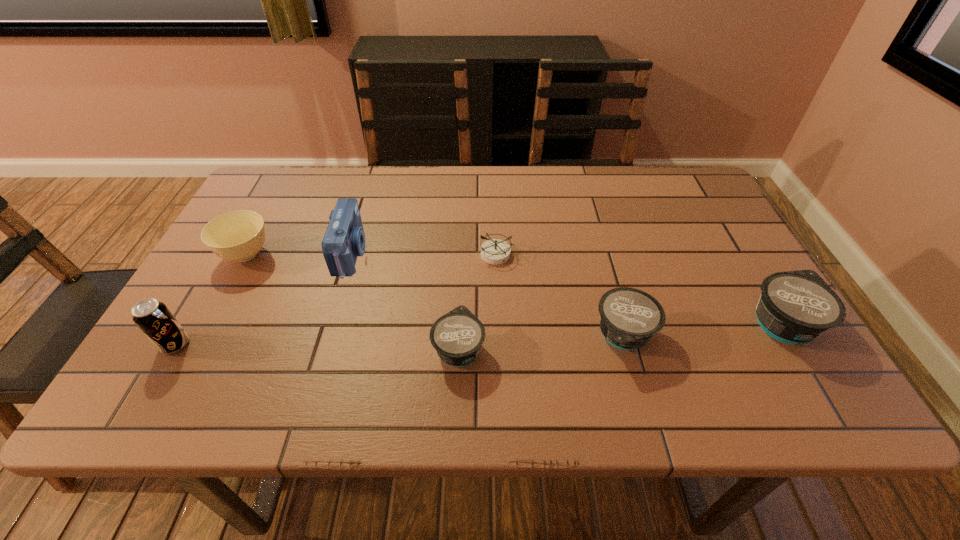
Where is `the leftmost yogurt`? The height and width of the screenshot is (540, 960). the leftmost yogurt is located at coordinates (457, 336).

I want to click on the second yogurt from right to left, so click(629, 317).

This screenshot has width=960, height=540. Find the location of `the third shortest object`. the third shortest object is located at coordinates [x=629, y=317].

Where is `the rightmost object`? Image resolution: width=960 pixels, height=540 pixels. the rightmost object is located at coordinates (794, 307).

This screenshot has width=960, height=540. Find the location of `sugar bowl`. sugar bowl is located at coordinates (239, 235).

The width and height of the screenshot is (960, 540). Identify the location of the third object from left to right. (344, 240).

At what (x,y) coordinates should I click in order to perform the action: click on the shortest object. Please return your answer as a coordinate pair (x, y). This screenshot has width=960, height=540. Looking at the image, I should click on (494, 251).

Find the location of a particular element. This screenshot has width=960, height=540. soda can is located at coordinates (154, 319).

Locate an element on the screen. free location located 0.090m on the right of the leftmost yogurt is located at coordinates (529, 348).

Where is `free spot located 0.210m on the left of the second yogurt from right to left`? This screenshot has height=540, width=960. free spot located 0.210m on the left of the second yogurt from right to left is located at coordinates (493, 336).